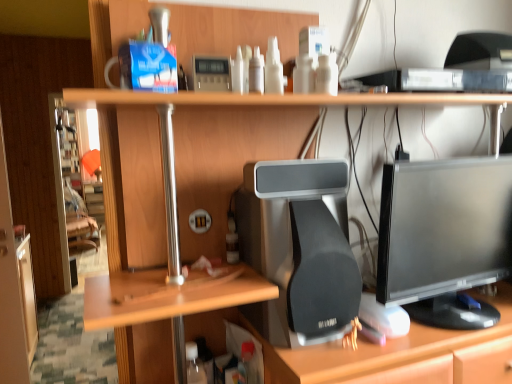
Question: Is wooden desk at center not near matte black desktop computer at center?

Choices:
 (A) yes
 (B) no

Answer: (B)

Question: Can you confirm if wooden desk at center is thinner than matte black desktop computer at center?

Choices:
 (A) no
 (B) yes

Answer: (A)

Question: Does wooden desk at center have a lesser height compared to matte black desktop computer at center?

Choices:
 (A) no
 (B) yes

Answer: (A)

Question: Does wooden desk at center have a larger size compared to matte black desktop computer at center?

Choices:
 (A) no
 (B) yes

Answer: (B)

Question: From a real-world perspective, is wooden desk at center over matte black desktop computer at center?

Choices:
 (A) no
 (B) yes

Answer: (A)

Question: Does wooden desk at center have a greater width compared to matte black desktop computer at center?

Choices:
 (A) yes
 (B) no

Answer: (A)

Question: From the image's perspective, is black glossy monitor at center right beneath wooden desk at center?

Choices:
 (A) no
 (B) yes

Answer: (A)

Question: Does black glossy monitor at center right touch wooden desk at center?

Choices:
 (A) no
 (B) yes

Answer: (A)

Question: Does black glossy monitor at center right appear on the right side of wooden desk at center?

Choices:
 (A) no
 (B) yes

Answer: (B)

Question: Considering the relative sizes of black glossy monitor at center right and wooden desk at center in the image provided, is black glossy monitor at center right shorter than wooden desk at center?

Choices:
 (A) yes
 (B) no

Answer: (A)

Question: Does black glossy monitor at center right appear on the left side of wooden desk at center?

Choices:
 (A) no
 (B) yes

Answer: (A)

Question: Considering the relative sizes of black glossy monitor at center right and wooden desk at center in the image provided, is black glossy monitor at center right smaller than wooden desk at center?

Choices:
 (A) no
 (B) yes

Answer: (B)

Question: Does matte black desktop computer at center have a smaller size compared to black glossy monitor at center right?

Choices:
 (A) yes
 (B) no

Answer: (A)